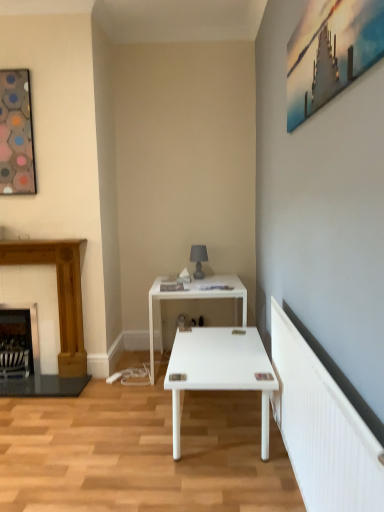
Question: Is wooden fireplace at left, acting as the first fireplace starting from the right, far away from white glossy table at center?

Choices:
 (A) no
 (B) yes

Answer: (A)

Question: Considering the relative positions of wooden fireplace at left, arranged as the 2th fireplace when viewed from the left, and white glossy table at center in the image provided, is wooden fireplace at left, arranged as the 2th fireplace when viewed from the left, behind white glossy table at center?

Choices:
 (A) yes
 (B) no

Answer: (A)

Question: Is the position of wooden fireplace at left, acting as the first fireplace starting from the right, less distant than that of white glossy table at center?

Choices:
 (A) yes
 (B) no

Answer: (B)

Question: Considering the relative sizes of wooden fireplace at left, arranged as the 2th fireplace when viewed from the left, and white glossy table at center in the image provided, is wooden fireplace at left, arranged as the 2th fireplace when viewed from the left, taller than white glossy table at center?

Choices:
 (A) yes
 (B) no

Answer: (A)

Question: From a real-world perspective, is wooden fireplace at left, acting as the first fireplace starting from the right, beneath white glossy table at center?

Choices:
 (A) no
 (B) yes

Answer: (A)

Question: From a real-world perspective, is wooden fireplace at left, acting as the first fireplace starting from the right, on white glossy table at center?

Choices:
 (A) no
 (B) yes

Answer: (B)

Question: Is hexagonal mosaic frame at upper left, which appears as the second picture frame when viewed from the right, further to camera compared to white glossy table at center?

Choices:
 (A) no
 (B) yes

Answer: (A)

Question: Are hexagonal mosaic frame at upper left, positioned as the first picture frame in back-to-front order, and white glossy table at center beside each other?

Choices:
 (A) yes
 (B) no

Answer: (B)

Question: Is hexagonal mosaic frame at upper left, which appears as the second picture frame when viewed from the right, positioned before white glossy table at center?

Choices:
 (A) yes
 (B) no

Answer: (A)

Question: Can you confirm if hexagonal mosaic frame at upper left, positioned as the first picture frame in back-to-front order, is thinner than white glossy table at center?

Choices:
 (A) yes
 (B) no

Answer: (A)

Question: From a real-world perspective, is hexagonal mosaic frame at upper left, which is the second picture frame in front-to-back order, positioned over white glossy table at center based on gravity?

Choices:
 (A) yes
 (B) no

Answer: (A)

Question: Can you confirm if hexagonal mosaic frame at upper left, which is the second picture frame in front-to-back order, is smaller than white glossy table at center?

Choices:
 (A) yes
 (B) no

Answer: (A)

Question: Is wooden fireplace at left, acting as the first fireplace starting from the right, outside dark wood fireplace at left, acting as the 1th fireplace starting from the left?

Choices:
 (A) no
 (B) yes

Answer: (B)